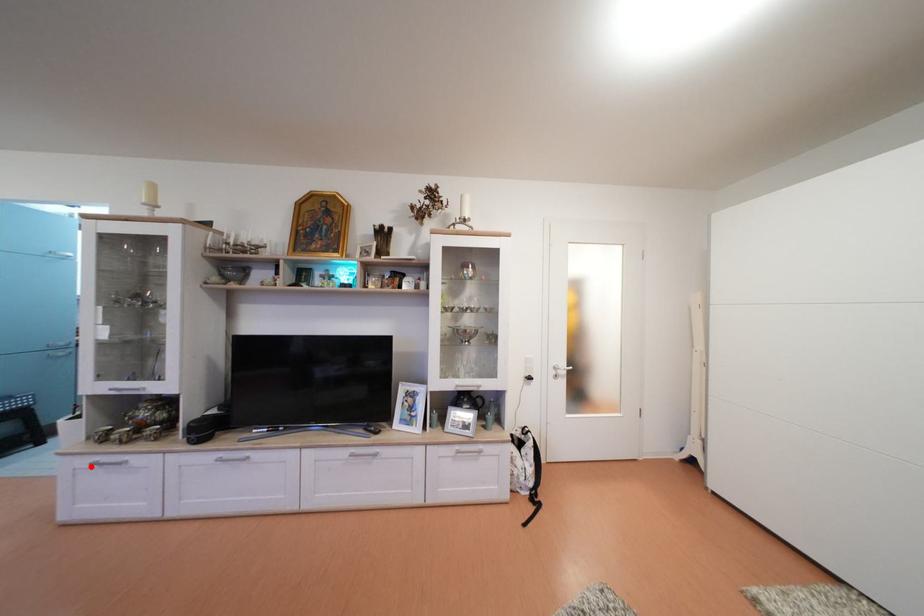
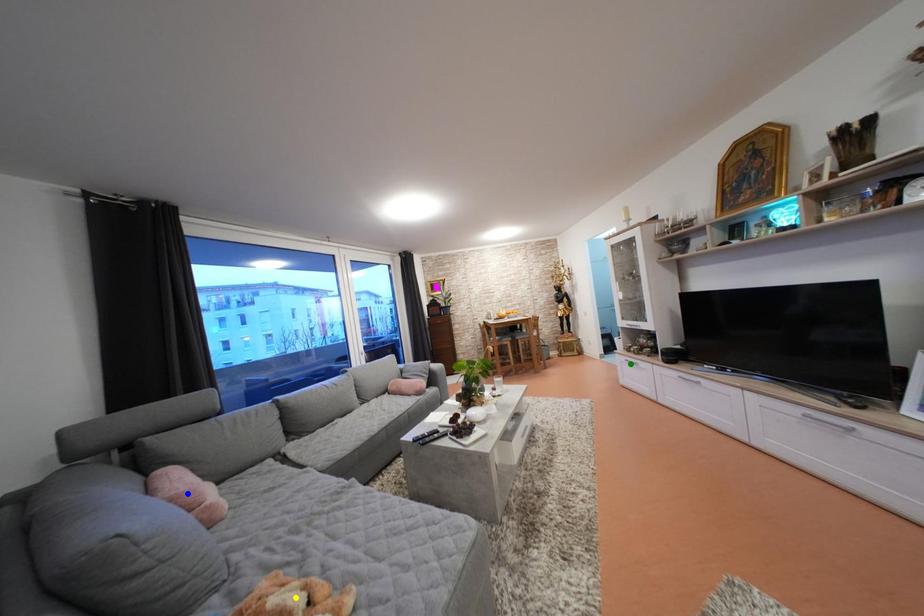
Question: I am providing you with two images of the same scene from different viewpoints. A red point is marked on the first image. You are given multiple points on the second image. Can you choose the point in image 2 that corresponds to the point in image 1?

Choices:
 (A) yellow point
 (B) blue point
 (C) green point

Answer: (C)